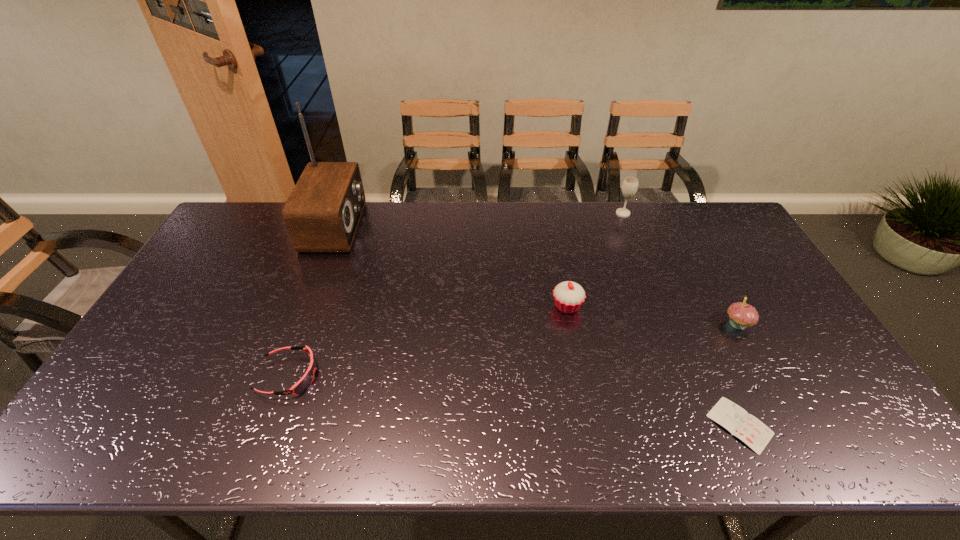
Locate an element on the screen. This screenshot has height=540, width=960. free space at the far right corner of the desktop is located at coordinates (727, 228).

The width and height of the screenshot is (960, 540). I want to click on free spot between the second shortest object and the rightmost object, so click(513, 350).

The width and height of the screenshot is (960, 540). I want to click on empty space that is in between the second tallest object and the fifth tallest object, so click(456, 294).

Identify the location of free spot between the rightmost object and the shortest object. This screenshot has width=960, height=540. (738, 374).

Locate an element on the screen. empty location between the radio receiver and the diary is located at coordinates (538, 325).

I want to click on vacant space that's between the fifth tallest object and the radio receiver, so click(x=312, y=301).

At what (x,y) coordinates should I click in order to perform the action: click on vacant area that lies between the diary and the left cupcake. Please return your answer as a coordinate pair (x, y). This screenshot has width=960, height=540. Looking at the image, I should click on (654, 365).

This screenshot has width=960, height=540. In order to click on free space that is in between the fifth tallest object and the wineglass in this screenshot , I will do `click(456, 294)`.

Identify the location of free area in between the fifth shortest object and the radio receiver. (479, 220).

I want to click on free space between the third object from left to right and the wineglass, so click(595, 260).